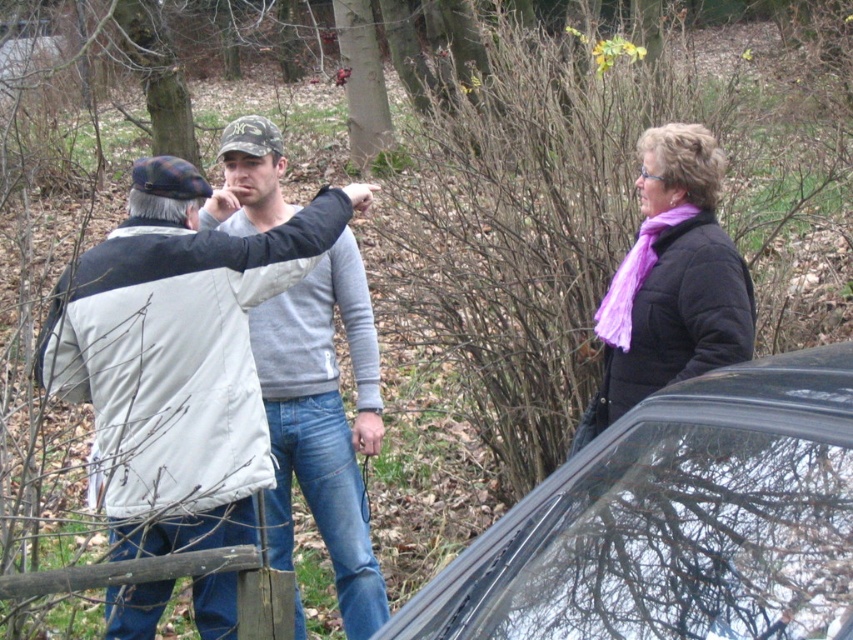
Which is more to the left, black glossy car at lower right or gray fleece jacket at center?

gray fleece jacket at center

Does black glossy car at lower right have a smaller size compared to gray fleece jacket at center?

Yes, black glossy car at lower right is smaller than gray fleece jacket at center.

Between point (640, 621) and point (83, 358), which one is positioned behind?

Positioned behind is point (83, 358).

This screenshot has height=640, width=853. I want to click on black glossy car at lower right, so click(x=676, y=522).

Based on the photo, which of these two, camo fabric baseball cap at center or purple quilted jacket at upper right, stands shorter?

purple quilted jacket at upper right

Is point (296, 380) behind point (694, 248)?

Yes, point (296, 380) is farther from viewer.

Find the location of a particular element. This screenshot has width=853, height=640. camo fabric baseball cap at center is located at coordinates point(323,422).

Between gray fleece jacket at center and purple quilted jacket at upper right, which one is positioned lower?

gray fleece jacket at center

Who is positioned more to the left, gray fleece jacket at center or purple quilted jacket at upper right?

gray fleece jacket at center

The height and width of the screenshot is (640, 853). I want to click on gray fleece jacket at center, so click(178, 355).